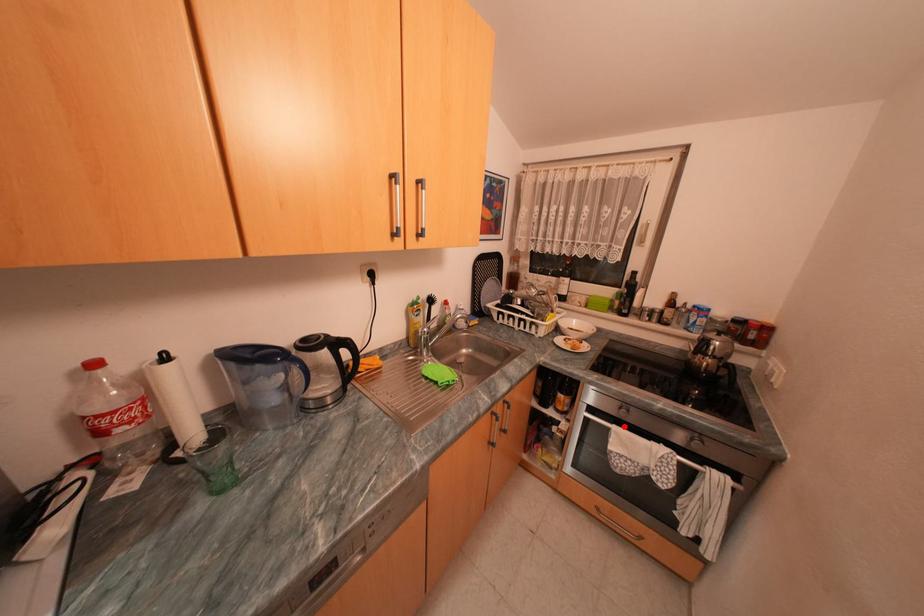
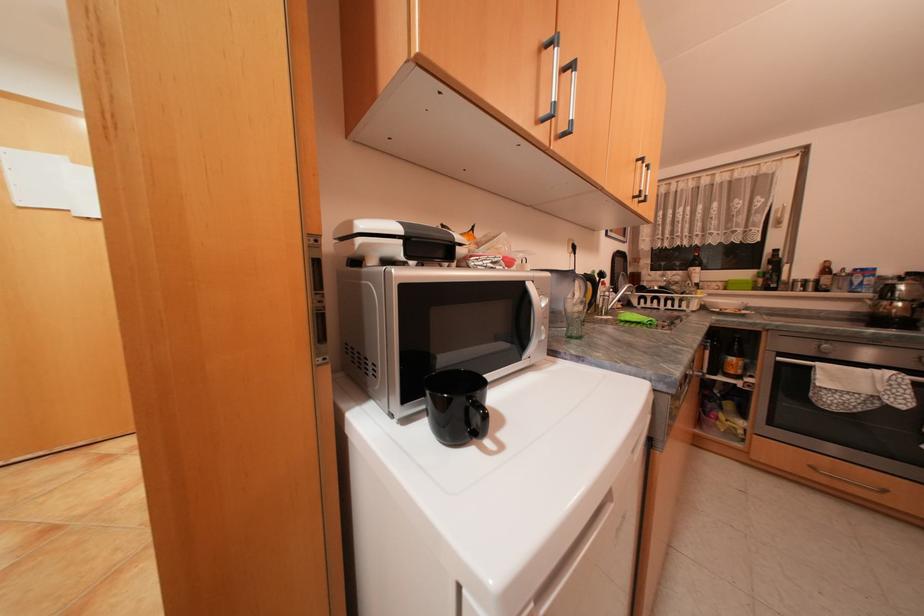
Locate, in the second image, the point that corresponds to the highlighted location in the first image.

(830, 363)